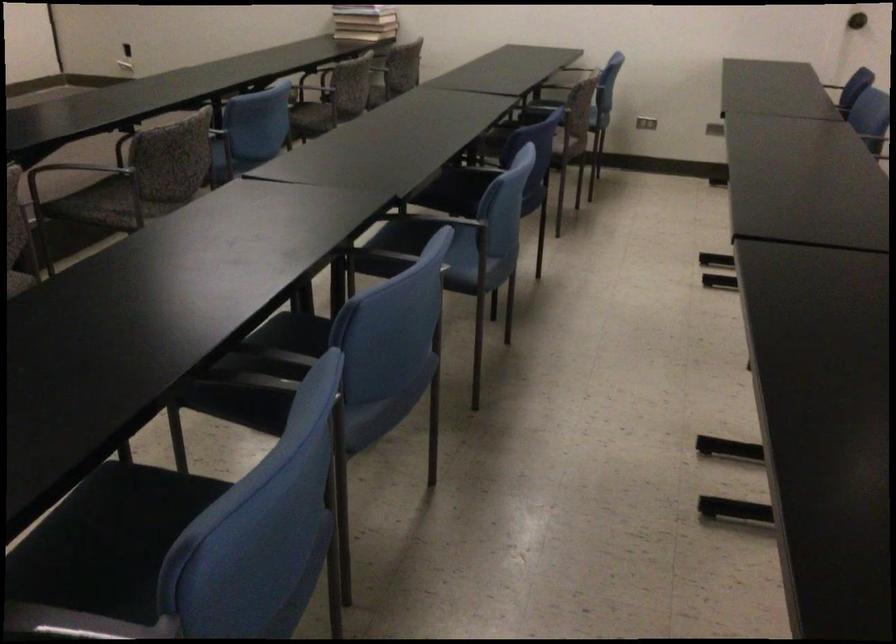
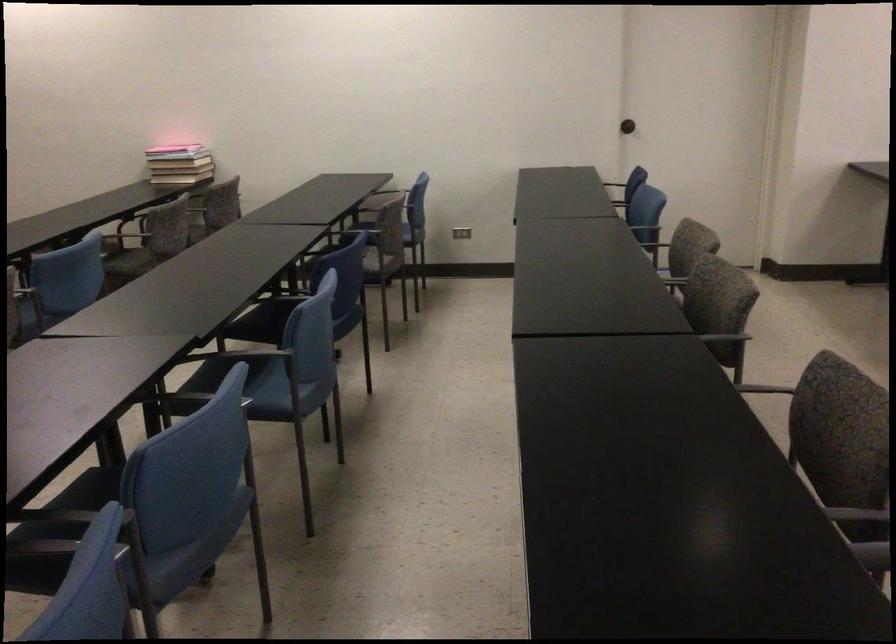
Find the pixel in the second image that matches (x=647, y=120) in the first image.

(461, 232)